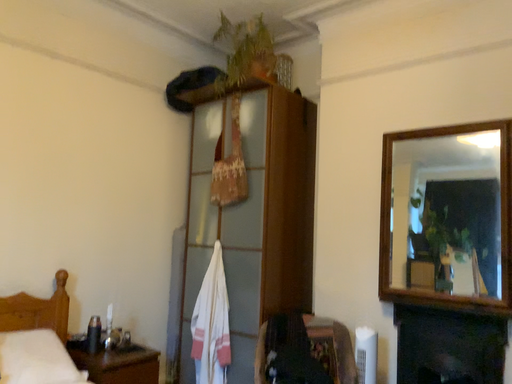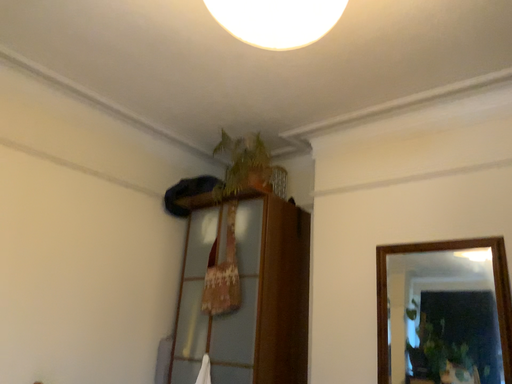
Question: How did the camera likely rotate when shooting the video?

Choices:
 (A) rotated upward
 (B) rotated downward

Answer: (A)